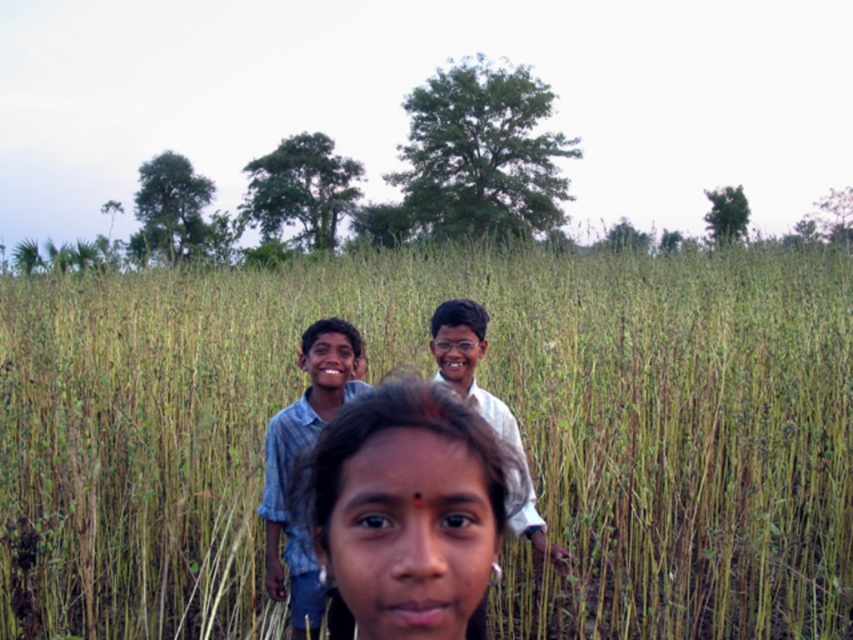
Question: Which point is closer to the camera?

Choices:
 (A) (302, 609)
 (B) (323, 513)

Answer: (B)

Question: Does green grass at center appear over blue denim shirt at center?

Choices:
 (A) no
 (B) yes

Answer: (B)

Question: Does smooth skin face at center have a lesser width compared to white glossy shirt at center?

Choices:
 (A) yes
 (B) no

Answer: (A)

Question: Which of the following is the farthest from the observer?

Choices:
 (A) (498, 410)
 (B) (126, 422)
 (C) (288, 548)
 (D) (335, 435)

Answer: (B)

Question: Can you confirm if green grass at center is thinner than white glossy shirt at center?

Choices:
 (A) yes
 (B) no

Answer: (B)

Question: Which point appears farthest from the camera in this image?

Choices:
 (A) (386, 524)
 (B) (543, 541)
 (C) (113, 582)

Answer: (C)